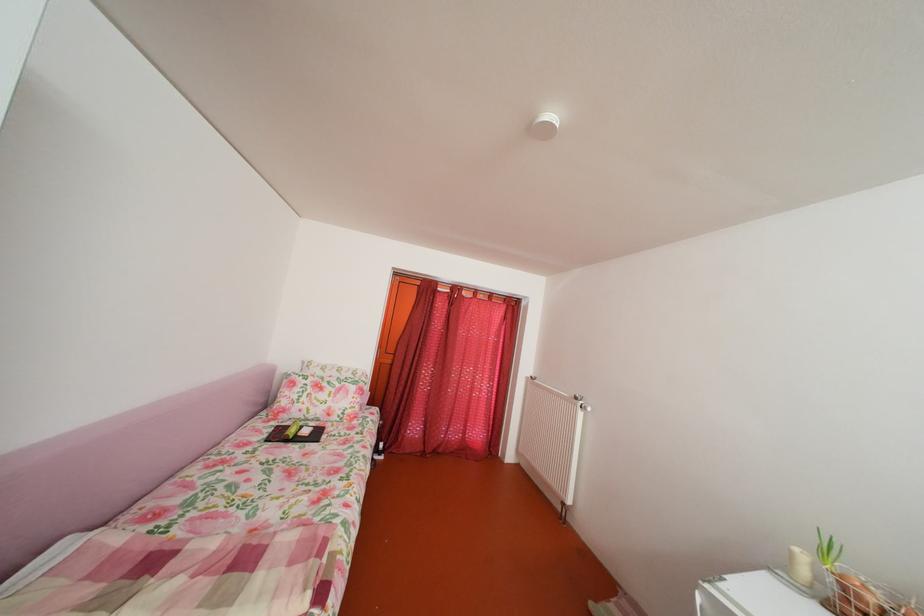
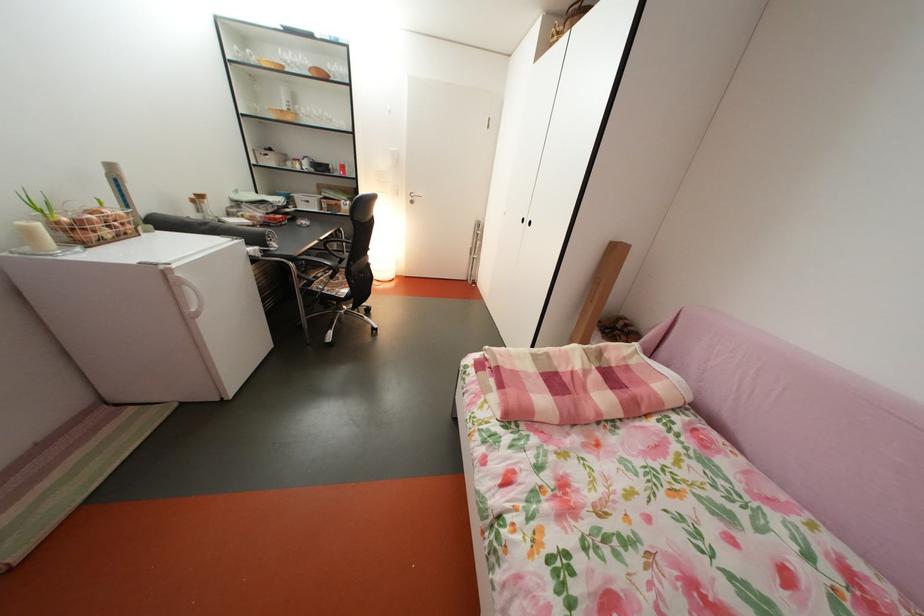
In the second image, find the point that corresponds to point 163,588 in the first image.

(604, 374)